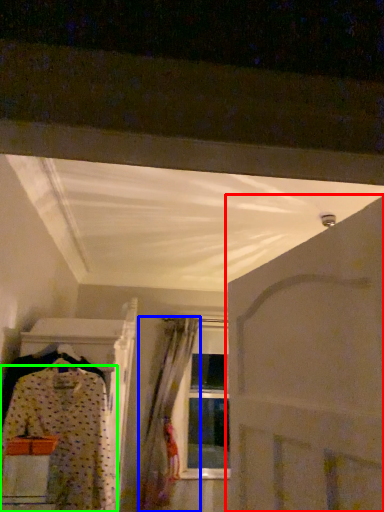
Question: Which is farther away from door (highlighted by a red box)? curtain (highlighted by a blue box) or fancy dress (highlighted by a green box)?

Choices:
 (A) curtain
 (B) fancy dress

Answer: (A)